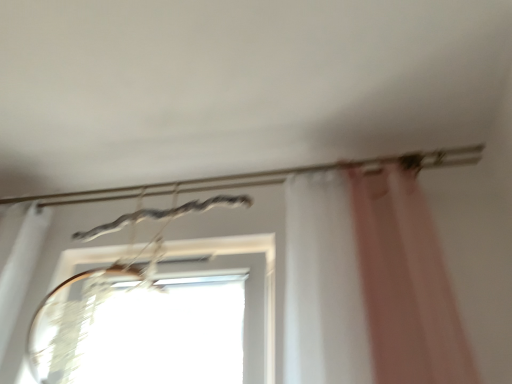
Question: Visually, is metallic wire at upper center positioned to the left or to the right of transparent glass window at center?

Choices:
 (A) left
 (B) right

Answer: (B)

Question: Based on their sizes in the image, would you say metallic wire at upper center is bigger or smaller than transparent glass window at center?

Choices:
 (A) small
 (B) big

Answer: (A)

Question: Is point (13, 198) closer or farther from the camera than point (158, 296)?

Choices:
 (A) closer
 (B) farther

Answer: (B)

Question: Considering the positions of point tap(268, 322) and point tap(309, 170), is point tap(268, 322) closer or farther from the camera than point tap(309, 170)?

Choices:
 (A) farther
 (B) closer

Answer: (B)

Question: Which is correct: transparent glass window at center is inside metallic wire at upper center, or outside of it?

Choices:
 (A) outside
 (B) inside

Answer: (A)

Question: From a real-world perspective, is transparent glass window at center above or below metallic wire at upper center?

Choices:
 (A) below
 (B) above

Answer: (A)

Question: In terms of height, does transparent glass window at center look taller or shorter compared to metallic wire at upper center?

Choices:
 (A) short
 (B) tall

Answer: (B)